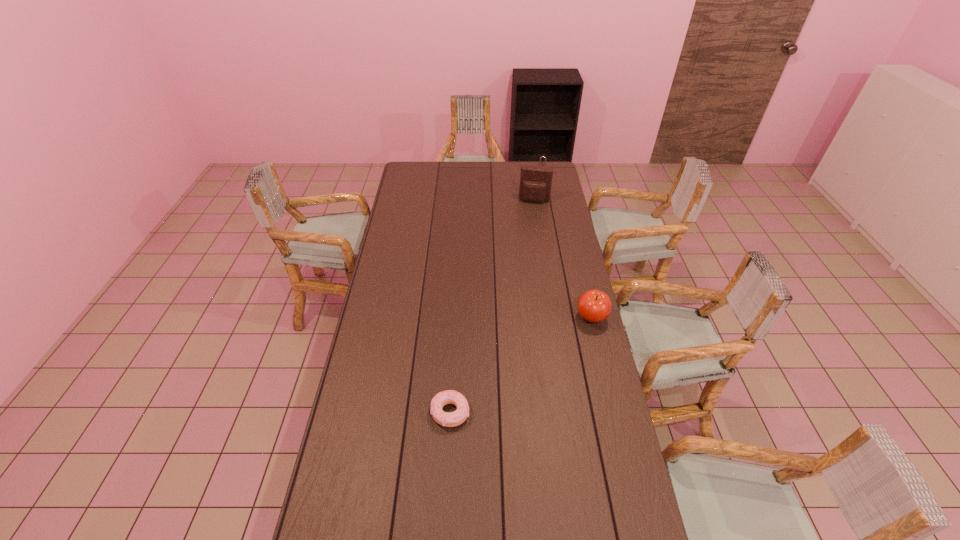
Find the location of a particular element. The width and height of the screenshot is (960, 540). the leftmost object is located at coordinates (455, 418).

The image size is (960, 540). I want to click on the nearest object, so click(455, 418).

This screenshot has height=540, width=960. I want to click on the rightmost object, so click(594, 306).

Find the location of `the third farthest object`. the third farthest object is located at coordinates (594, 306).

Identify the location of the farthest object. This screenshot has width=960, height=540. (542, 156).

Find the location of a particular element. the second farthest object is located at coordinates pyautogui.click(x=535, y=182).

Locate an element on the screen. The width and height of the screenshot is (960, 540). the tallest object is located at coordinates (535, 182).

Find the location of a particular element. free region located on the back of the shortest object is located at coordinates (453, 357).

Where is `free space located 0.060m on the left of the rightmost object`? The image size is (960, 540). free space located 0.060m on the left of the rightmost object is located at coordinates pyautogui.click(x=561, y=318).

Identify the location of free space located 0.070m on the shackle of the padlock. This screenshot has width=960, height=540. (540, 185).